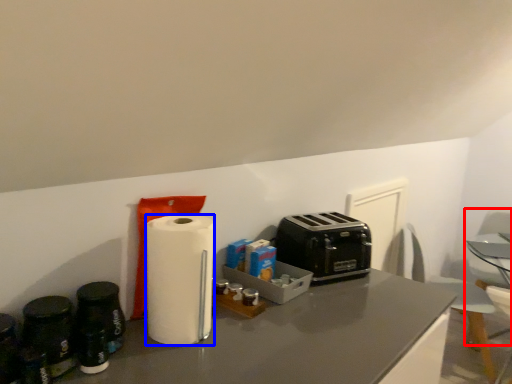
Question: Which object is closer to the camera taking this photo, swivel chair (highlighted by a red box) or paper towel (highlighted by a blue box)?

Choices:
 (A) swivel chair
 (B) paper towel

Answer: (B)